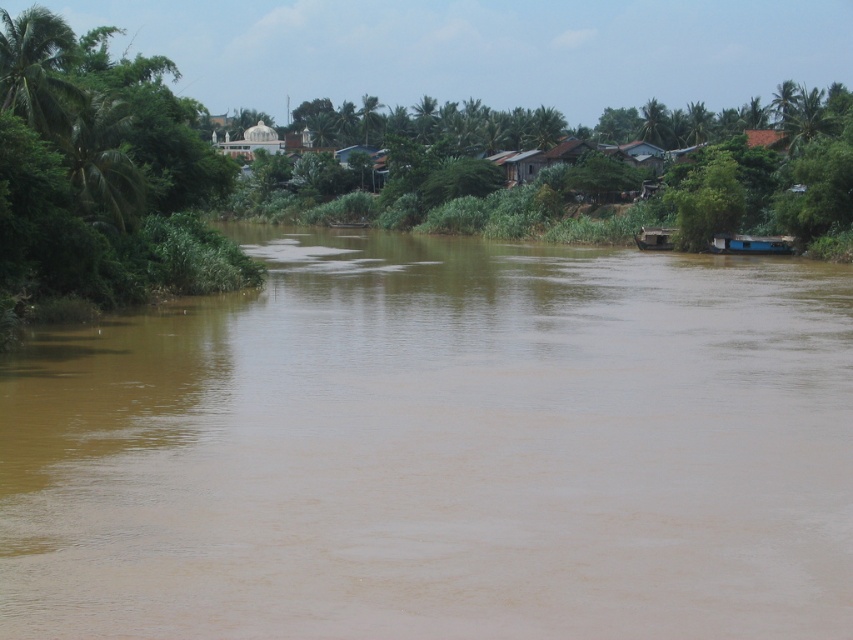
You are standing on the riverbank and notice the green leafy tree at left and the brown wooden boat at right. Which object appears bigger in the scene?

The green leafy tree at left appears bigger than the brown wooden boat at right in the scene.

You are standing on the riverbank and see the brown muddy water at center and the brown wooden boat at right. Which object is closer to the ground?

The brown muddy water at center is located below brown wooden boat at right, so it is closer to the ground.

Based on the photo, you are standing on the riverbank and want to take a photo of both the green leafy tree at left and the brown wooden boat at right. Which object should you adjust your camera angle upwards to include in the frame?

You should adjust your camera angle upwards to include the green leafy tree at left because it is taller than the brown wooden boat at right.